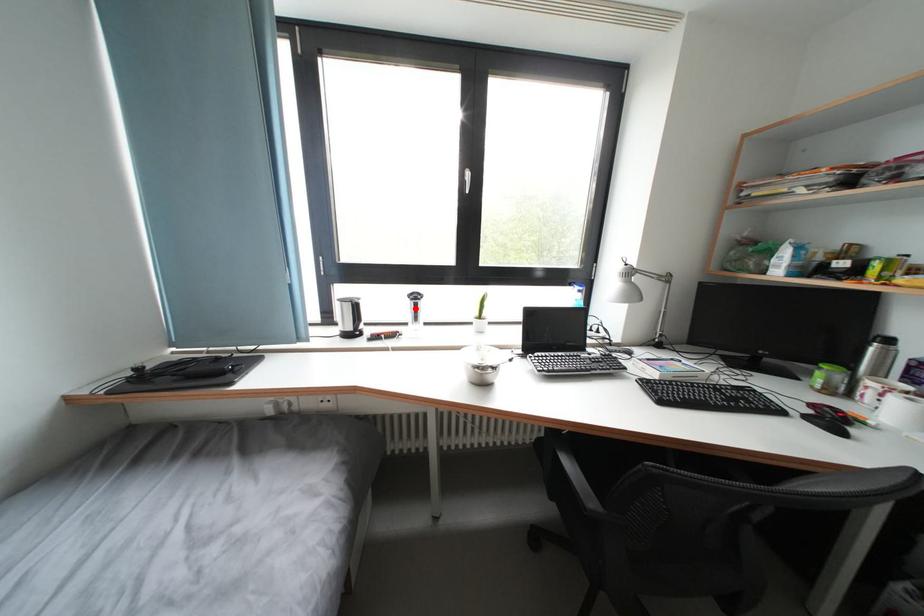
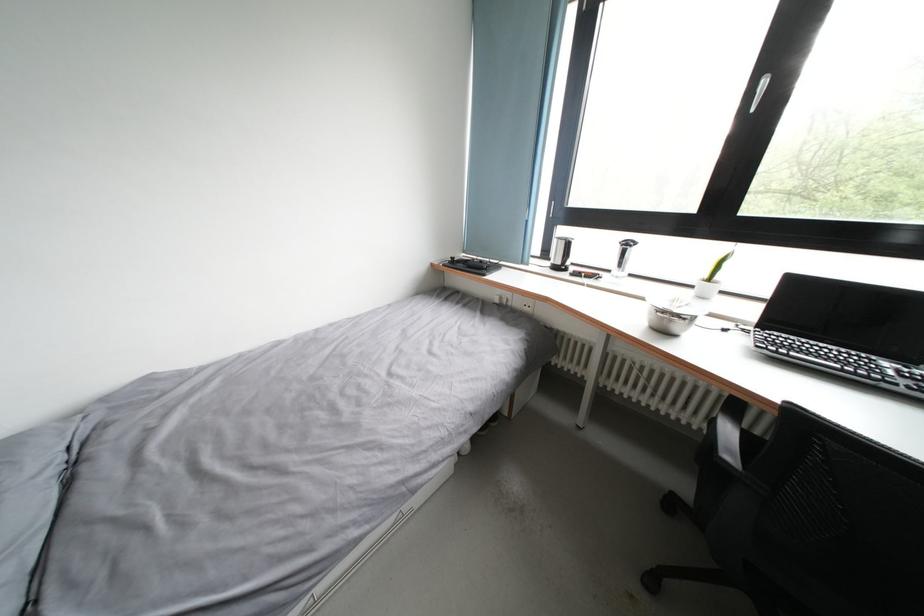
Question: I am providing you with two images of the same scene from different viewpoints. A red point is marked on the first image. Can you still see the location of the red point in image 2?

Choices:
 (A) Yes
 (B) No

Answer: (A)